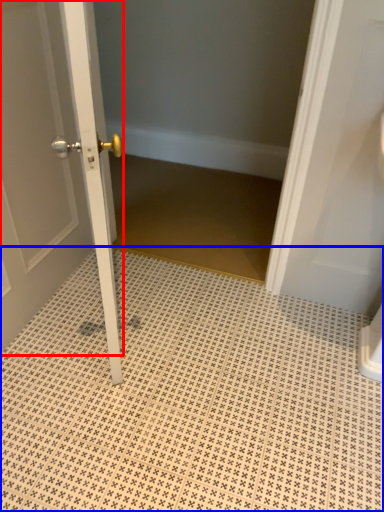
Question: Which of the following is the farthest to the observer, door (highlighted by a red box) or ceramic tile (highlighted by a blue box)?

Choices:
 (A) door
 (B) ceramic tile

Answer: (B)